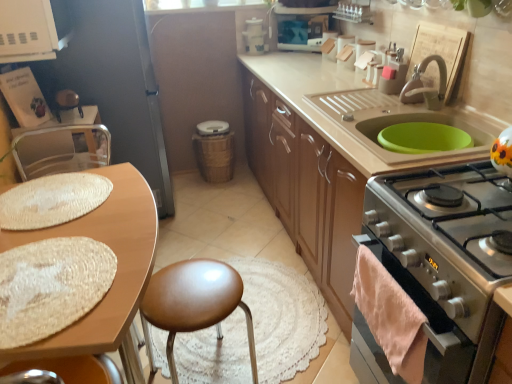
The image size is (512, 384). What are the coordinates of `vacant area that lies between brown leather stool at center and woven brown trash can at center, which appears as the first appliance when viewed from the left` in the screenshot? It's located at (217, 233).